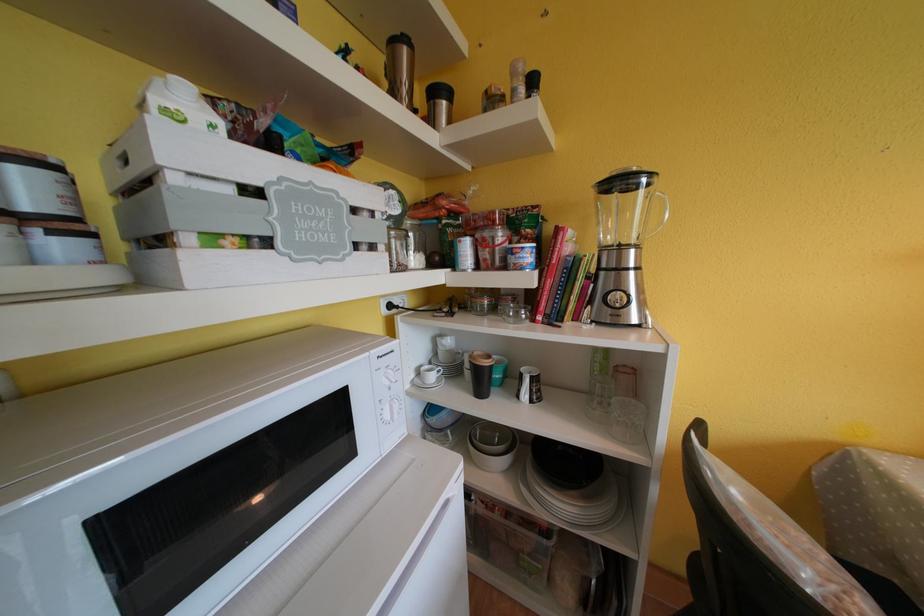
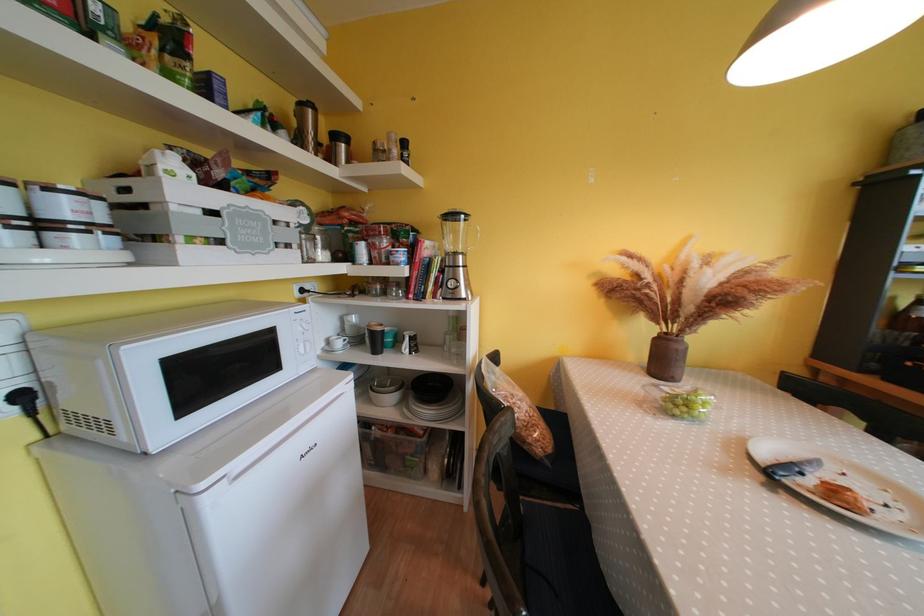
The point at (590, 293) is marked in the first image. Where is the corresponding point in the second image?

(444, 282)